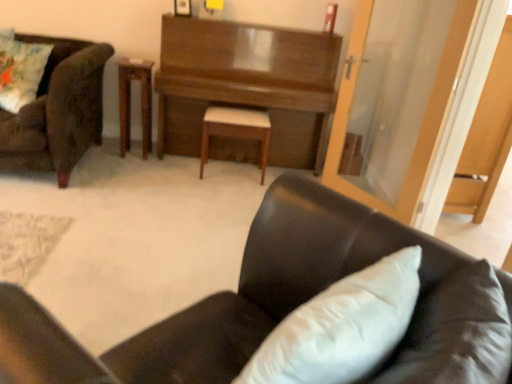
Question: Relative to black leather chair at lower right, positioned as the 1th chair in front-to-back order, is velvet brown armchair at left, marked as the 2th chair in a front-to-back arrangement, in front or behind?

Choices:
 (A) front
 (B) behind

Answer: (B)

Question: Is velvet brown armchair at left, marked as the 2th chair in a front-to-back arrangement, bigger or smaller than black leather chair at lower right, the second chair when ordered from left to right?

Choices:
 (A) big
 (B) small

Answer: (A)

Question: Estimate the real-world distances between objects in this image. Which object is farther from the black leather chair at lower right, the 1th chair positioned from the right?

Choices:
 (A) velvet brown armchair at left, positioned as the 2th chair in bottom-to-top order
 (B) transparent glass door at right
 (C) transparent glass door at upper right
 (D) floral fabric pillow at upper left
 (E) wooden table at center

Answer: (E)

Question: Which is farther from the transparent glass door at right?

Choices:
 (A) black leather chair at lower right, the second chair in the back-to-front sequence
 (B) transparent glass door at upper right
 (C) floral fabric pillow at upper left
 (D) wooden table at center
 (E) velvet brown armchair at left, marked as the 2th chair in a front-to-back arrangement

Answer: (C)